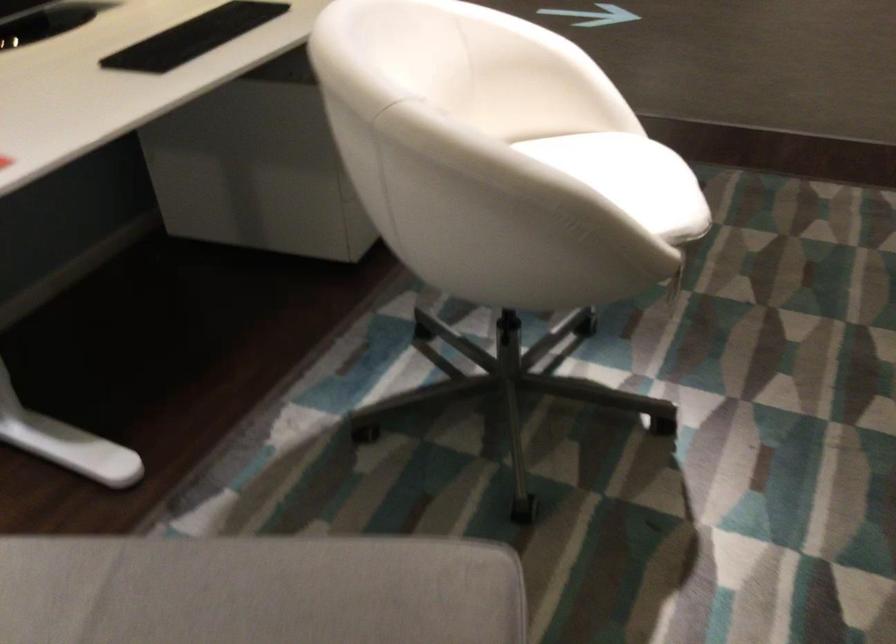
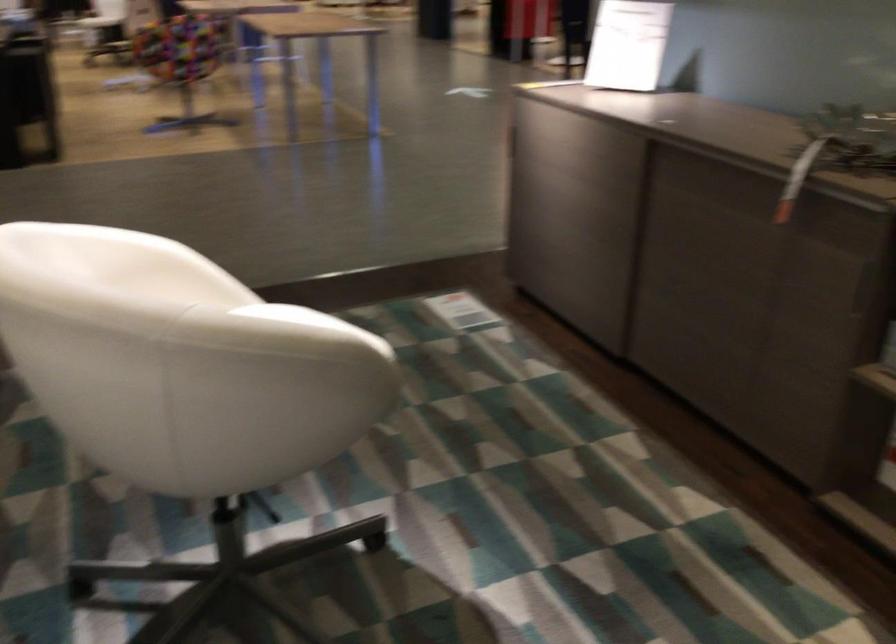
Question: The images are taken continuously from a first-person perspective. In which direction is your viewpoint rotating?

Choices:
 (A) Left
 (B) Right
 (C) Up
 (D) Down

Answer: (B)